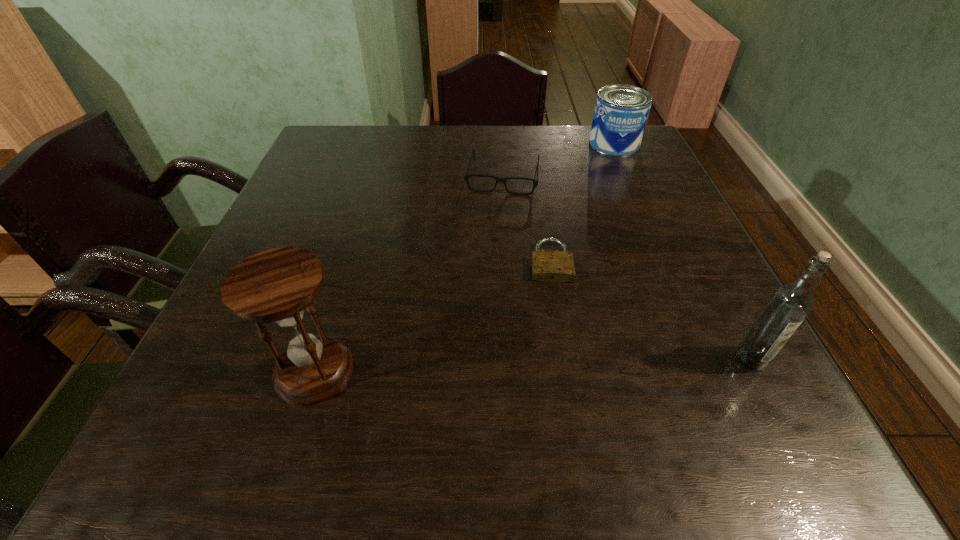
This screenshot has height=540, width=960. I want to click on hourglass, so click(x=276, y=285).

Where is `vodka`? vodka is located at coordinates (788, 306).

At what (x,y) coordinates should I click in order to perform the action: click on the third nearest object. Please return your answer as a coordinate pair (x, y). The height and width of the screenshot is (540, 960). Looking at the image, I should click on (553, 266).

Where is `the shortest object`? Image resolution: width=960 pixels, height=540 pixels. the shortest object is located at coordinates (553, 266).

You are a GUI agent. You are given a task and a screenshot of the screen. Output one action in this format:
    pyautogui.click(x=<x>, y=<y>)
    Task: Click on the farthest object
    This screenshot has width=960, height=540.
    Given the screenshot: What is the action you would take?
    pyautogui.click(x=621, y=111)

Find the location of `the third shortest object`. the third shortest object is located at coordinates (621, 111).

In order to click on spectacles in this screenshot , I will do `click(466, 177)`.

The width and height of the screenshot is (960, 540). Find the location of `the second shortest object`. the second shortest object is located at coordinates [466, 177].

The height and width of the screenshot is (540, 960). I want to click on vacant space located 0.050m on the left of the leftmost object, so click(x=246, y=370).

Identify the location of free point located 0.190m on the keyhole side of the shortest object. (561, 363).